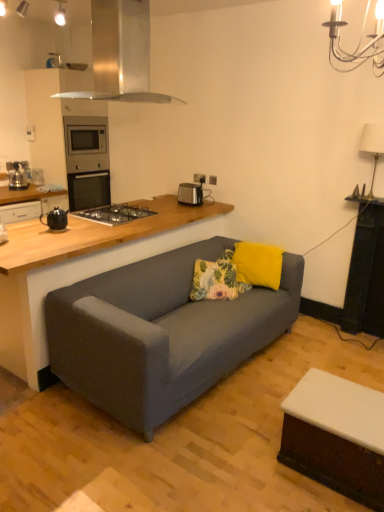
Question: Would you say black ceramic teapot at left, which is the first appliance in front-to-back order, is to the left or to the right of stainless steel range hood at upper center in the picture?

Choices:
 (A) right
 (B) left

Answer: (B)

Question: From a real-world perspective, relative to stainless steel range hood at upper center, is black ceramic teapot at left, which is the second appliance from back to front, vertically above or below?

Choices:
 (A) above
 (B) below

Answer: (B)

Question: Estimate the real-world distances between objects in this image. Which object is closer to the floral fabric pillow at center, the 2th pillow from the right?

Choices:
 (A) white ceramic lamp at upper right
 (B) yellow fabric pillow at upper right, the 2th pillow from the left
 (C) white glossy coffee table at lower right
 (D) stainless steel range hood at upper center
 (E) black plastic toaster at upper center, which appears as the second appliance when viewed from the front

Answer: (B)

Question: Considering the real-world distances, which object is closest to the black ceramic teapot at left, which is the first appliance in left-to-right order?

Choices:
 (A) white ceramic lamp at upper right
 (B) black matte gas stove at center
 (C) white glossy coffee table at lower right
 (D) yellow fabric pillow at upper right, the 2th pillow from the left
 (E) black plastic toaster at upper center, which ranks as the 2th appliance in left-to-right order

Answer: (B)